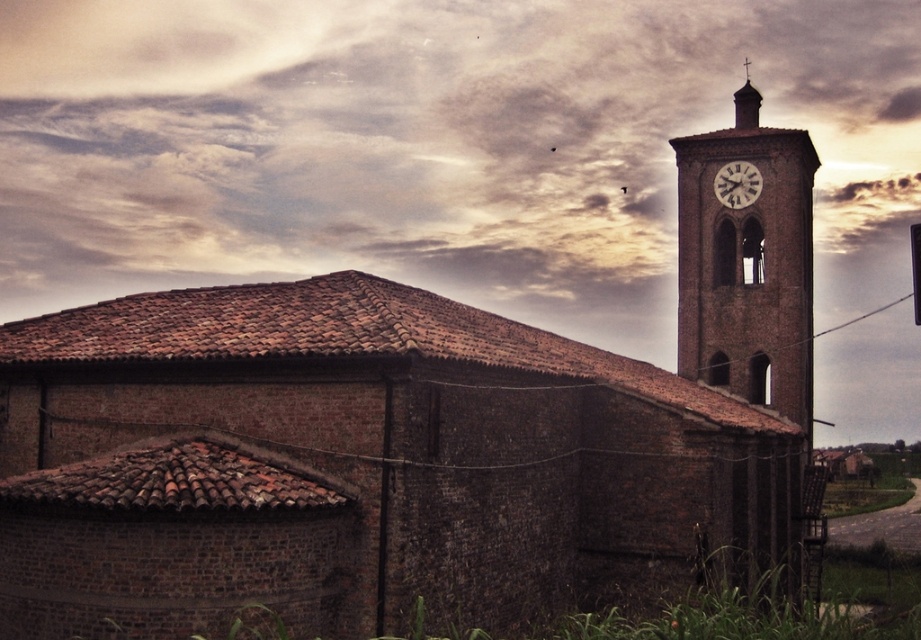
You are standing in front of the rustic brick church and want to take a photo of the brown brick clock tower at upper right. Based on its position, which direction should you face to capture it in your shot?

The brown brick clock tower at upper right is located at point (747, 269), which means it is positioned towards the upper right of the scene. To capture it, you should face the upper right direction, likely looking towards the right side of the church and upwards to include the tower in your photo.

You are a maintenance worker needing to reach both the brown brick clock tower at upper right and the white metallic clock at upper right. The ladder you have can extend up to 3 meters. Can you safely reach both objects with the ladder?

The brown brick clock tower at upper right and the white metallic clock at upper right are 3.39 meters apart. Since the ladder can only extend up to 3 meters, it is not long enough to safely reach both objects.

You are standing in front of the church and looking up. Where exactly is the cloudy sky at upper center located in the image?

The cloudy sky at upper center is located at point coordinates of (437, 147).